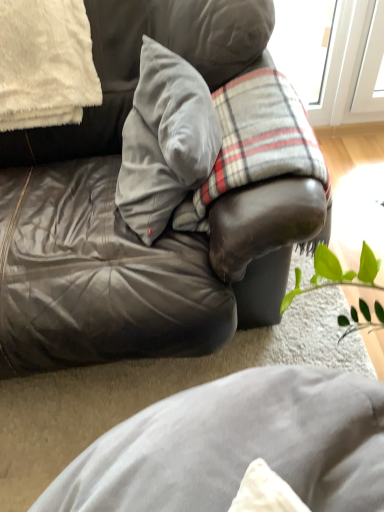
The height and width of the screenshot is (512, 384). I want to click on leather couch at center, so click(x=125, y=224).

From the picture: Measure the distance between point (x=221, y=58) and camera.

They are 3.61 feet apart.

At what (x,y) coordinates should I click in order to perform the action: click on velvet gray pillow at center, the 1th pillow positioned from the right. Please return your answer as a coordinate pair (x, y). Image resolution: width=384 pixels, height=512 pixels. Looking at the image, I should click on (165, 141).

Find the location of a particular element. The width and height of the screenshot is (384, 512). white fluffy pillow at upper left, the second pillow when ordered from right to left is located at coordinates (45, 64).

From the picture: Is leather couch at center not within white fluffy pillow at upper left, the second pillow when ordered from right to left?

leather couch at center is positioned outside white fluffy pillow at upper left, the second pillow when ordered from right to left.

Locate an element on the screen. Image resolution: width=384 pixels, height=512 pixels. studio couch on the right side of white fluffy pillow at upper left, the second pillow when ordered from right to left is located at coordinates (125, 224).

Which object is closer to the camera, leather couch at center or white fluffy pillow at upper left, the second pillow when ordered from right to left?

leather couch at center is in front.

Is leather couch at center thinner than white fluffy pillow at upper left, arranged as the first pillow when viewed from the left?

No, leather couch at center is not thinner than white fluffy pillow at upper left, arranged as the first pillow when viewed from the left.

Is velvet gray pillow at center, which ranks as the 2th pillow in left-to-right order, in contact with plaid fabric at center?

velvet gray pillow at center, which ranks as the 2th pillow in left-to-right order, and plaid fabric at center are clearly separated.

Consider the image. Would you say plaid fabric at center is part of velvet gray pillow at center, the 1th pillow positioned from the right,'s contents?

No, plaid fabric at center is located outside of velvet gray pillow at center, the 1th pillow positioned from the right.

Is velvet gray pillow at center, which ranks as the 2th pillow in left-to-right order, positioned behind plaid fabric at center?

No, it is in front of plaid fabric at center.

Is point (19, 126) in front of point (159, 181)?

No, it is not.

From a real-world perspective, is white fluffy pillow at upper left, the second pillow when ordered from right to left, over velvet gray pillow at center, the 1th pillow positioned from the right?

Yes, from a real-world perspective, white fluffy pillow at upper left, the second pillow when ordered from right to left, is on top of velvet gray pillow at center, the 1th pillow positioned from the right.

The image size is (384, 512). What are the coordinates of `pillow behind the velvet gray pillow at center, the 1th pillow positioned from the right` in the screenshot? It's located at (45, 64).

Can you confirm if white fluffy pillow at upper left, the second pillow when ordered from right to left, is thinner than velvet gray pillow at center, which ranks as the 2th pillow in left-to-right order?

No, white fluffy pillow at upper left, the second pillow when ordered from right to left, is not thinner than velvet gray pillow at center, which ranks as the 2th pillow in left-to-right order.

From a real-world perspective, relative to leather couch at center, is plaid fabric at center vertically above or below?

plaid fabric at center is situated lower than leather couch at center in the real world.

Between point (260, 143) and point (135, 77), which one is positioned behind?

The point (135, 77) is behind.

Is plaid fabric at center positioned with its back to leather couch at center?

Yes, plaid fabric at center's orientation is away from leather couch at center.

This screenshot has width=384, height=512. Identify the location of plaid below the leather couch at center (from the image's perspective). (256, 141).

Which is behind, velvet gray pillow at center, the 1th pillow positioned from the right, or leather couch at center?

velvet gray pillow at center, the 1th pillow positioned from the right, is more distant.

Looking at this image, is velvet gray pillow at center, which ranks as the 2th pillow in left-to-right order, oriented towards leather couch at center?

Yes, velvet gray pillow at center, which ranks as the 2th pillow in left-to-right order, is facing leather couch at center.

Is point (302, 112) closer or farther from the camera than point (118, 186)?

Point (302, 112).

Is plaid fabric at center with velvet gray pillow at center, which ranks as the 2th pillow in left-to-right order?

plaid fabric at center is not next to velvet gray pillow at center, which ranks as the 2th pillow in left-to-right order, and they're not touching.

Between plaid fabric at center and velvet gray pillow at center, the 1th pillow positioned from the right, which one has larger width?

With larger width is plaid fabric at center.

Is plaid fabric at center shorter than white fluffy pillow at upper left, arranged as the first pillow when viewed from the left?

Incorrect, the height of plaid fabric at center does not fall short of that of white fluffy pillow at upper left, arranged as the first pillow when viewed from the left.

Could you tell me if plaid fabric at center is turned towards white fluffy pillow at upper left, arranged as the first pillow when viewed from the left?

No, plaid fabric at center does not turn towards white fluffy pillow at upper left, arranged as the first pillow when viewed from the left.

From the image's perspective, is plaid fabric at center located above white fluffy pillow at upper left, arranged as the first pillow when viewed from the left?

Actually, plaid fabric at center appears below white fluffy pillow at upper left, arranged as the first pillow when viewed from the left, in the image.

In order to click on studio couch lying on the right of white fluffy pillow at upper left, arranged as the first pillow when viewed from the left in this screenshot , I will do `click(125, 224)`.

In the image, there is a velvet gray pillow at center, which ranks as the 2th pillow in left-to-right order. Find the location of `plaid below it (from a real-world perspective)`. plaid below it (from a real-world perspective) is located at coordinates (256, 141).

Which object lies nearer to the anchor point leather couch at center, plaid fabric at center or velvet gray pillow at center, the 1th pillow positioned from the right?

Based on the image, velvet gray pillow at center, the 1th pillow positioned from the right, appears to be nearer to leather couch at center.

From the image, which object appears to be farther from velvet gray pillow at center, which ranks as the 2th pillow in left-to-right order, plaid fabric at center or white fluffy pillow at upper left, arranged as the first pillow when viewed from the left?

Among the two, white fluffy pillow at upper left, arranged as the first pillow when viewed from the left, is located further to velvet gray pillow at center, which ranks as the 2th pillow in left-to-right order.

When comparing their distances from plaid fabric at center, does velvet gray pillow at center, which ranks as the 2th pillow in left-to-right order, or white fluffy pillow at upper left, the second pillow when ordered from right to left, seem closer?

velvet gray pillow at center, which ranks as the 2th pillow in left-to-right order.

Consider the image. Estimate the real-world distances between objects in this image. Which object is further from leather couch at center, white fluffy pillow at upper left, the second pillow when ordered from right to left, or plaid fabric at center?

Based on the image, white fluffy pillow at upper left, the second pillow when ordered from right to left, appears to be further to leather couch at center.

Looking at the image, which one is located further to velvet gray pillow at center, which ranks as the 2th pillow in left-to-right order, white fluffy pillow at upper left, the second pillow when ordered from right to left, or plaid fabric at center?

Among the two, white fluffy pillow at upper left, the second pillow when ordered from right to left, is located further to velvet gray pillow at center, which ranks as the 2th pillow in left-to-right order.

From the image, which object appears to be farther from white fluffy pillow at upper left, arranged as the first pillow when viewed from the left, velvet gray pillow at center, which ranks as the 2th pillow in left-to-right order, or leather couch at center?

velvet gray pillow at center, which ranks as the 2th pillow in left-to-right order, is further to white fluffy pillow at upper left, arranged as the first pillow when viewed from the left.

When comparing their distances from white fluffy pillow at upper left, the second pillow when ordered from right to left, does leather couch at center or velvet gray pillow at center, which ranks as the 2th pillow in left-to-right order, seem further?

The object further to white fluffy pillow at upper left, the second pillow when ordered from right to left, is velvet gray pillow at center, which ranks as the 2th pillow in left-to-right order.

Looking at this image, based on their spatial positions, is velvet gray pillow at center, which ranks as the 2th pillow in left-to-right order, or white fluffy pillow at upper left, arranged as the first pillow when viewed from the left, closer to leather couch at center?

velvet gray pillow at center, which ranks as the 2th pillow in left-to-right order, is closer to leather couch at center.

Identify the location of pillow between leather couch at center and plaid fabric at center in the horizontal direction. This screenshot has height=512, width=384. (165, 141).

Find the location of a particular element. This screenshot has height=512, width=384. pillow between white fluffy pillow at upper left, arranged as the first pillow when viewed from the left, and plaid fabric at center, in the horizontal direction is located at coordinates (165, 141).

This screenshot has width=384, height=512. In order to click on pillow between leather couch at center and white fluffy pillow at upper left, arranged as the first pillow when viewed from the left, from front to back in this screenshot , I will do `click(165, 141)`.

Identify the location of studio couch between white fluffy pillow at upper left, arranged as the first pillow when viewed from the left, and plaid fabric at center. (125, 224).